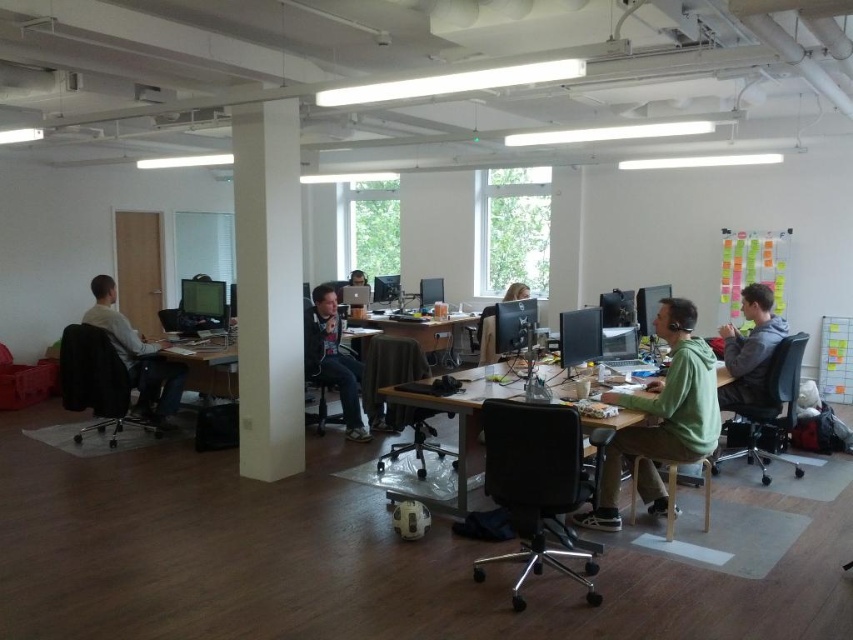
Question: Which object appears closest to the camera in this image?

Choices:
 (A) wooden desk at center
 (B) matte gray hoodie at left
 (C) gray hoodie at right

Answer: (C)

Question: Is green matte desk at center bigger than wooden desk at center?

Choices:
 (A) yes
 (B) no

Answer: (B)

Question: Estimate the real-world distances between objects in this image. Which object is closer to the matte black monitor at center?

Choices:
 (A) green matte desk at center
 (B) matte black hoodie at center
 (C) white smooth pillar at center
 (D) green matte hoodie at center

Answer: (A)

Question: Is matte gray hoodie at left below matte black hoodie at center?

Choices:
 (A) yes
 (B) no

Answer: (B)

Question: From the image, what is the correct spatial relationship of gray hoodie at right in relation to matte black monitor at center?

Choices:
 (A) above
 (B) below

Answer: (B)

Question: Which of the following is the closest to the observer?

Choices:
 (A) matte black monitor at center
 (B) matte gray hoodie at left
 (C) white smooth pillar at center

Answer: (C)